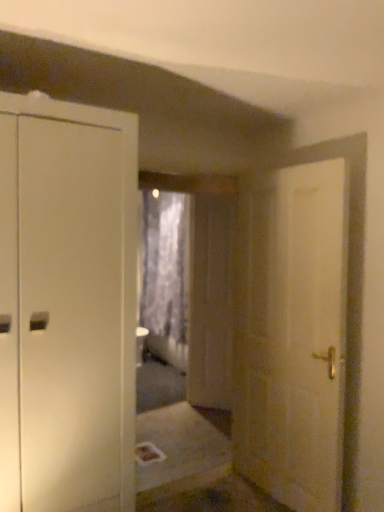
What do you see at coordinates (291, 334) in the screenshot?
I see `white matte door at right` at bounding box center [291, 334].

Measure the distance between transparent plastic screen door at center and camera.

transparent plastic screen door at center is 12.70 feet from camera.

Locate an element on the screen. This screenshot has height=512, width=384. white matte door at right is located at coordinates (291, 334).

Based on their sizes in the image, would you say transparent plastic screen door at center is bigger or smaller than gray textured curtain at center?

Clearly, transparent plastic screen door at center is smaller in size than gray textured curtain at center.

Which object is further away from the camera, transparent plastic screen door at center or gray textured curtain at center?

gray textured curtain at center.

Considering the positions of objects transparent plastic screen door at center and gray textured curtain at center in the image provided, who is more to the right, transparent plastic screen door at center or gray textured curtain at center?

From the viewer's perspective, transparent plastic screen door at center appears more on the right side.

Is transparent plastic screen door at center oriented away from gray textured curtain at center?

No, transparent plastic screen door at center is not facing the opposite direction of gray textured curtain at center.

The height and width of the screenshot is (512, 384). In the image, there is a white matte door at right. Find the location of `screen door above it (from the image's perspective)`. screen door above it (from the image's perspective) is located at coordinates point(210,302).

Would you say transparent plastic screen door at center is inside or outside white matte door at right?

The correct answer is: outside.

Who is bigger, transparent plastic screen door at center or white matte door at right?

Bigger between the two is white matte door at right.

Is gray textured curtain at center beside transparent plastic screen door at center?

No, gray textured curtain at center is not with transparent plastic screen door at center.

Does gray textured curtain at center have a greater height compared to transparent plastic screen door at center?

Incorrect, the height of gray textured curtain at center is not larger of that of transparent plastic screen door at center.

From a real-world perspective, relative to transparent plastic screen door at center, is gray textured curtain at center vertically above or below?

gray textured curtain at center is above transparent plastic screen door at center.

Do you think gray textured curtain at center is within transparent plastic screen door at center, or outside of it?

The correct answer is: outside.

Which is farther from the camera, (241,358) or (163,324)?

The point (163,324) is behind.

Which object is closer to the camera taking this photo, white matte door at right or gray textured curtain at center?

white matte door at right is closer to the camera.

Is white matte door at right placed right next to gray textured curtain at center?

No, white matte door at right is not beside gray textured curtain at center.

From a real-world perspective, which is physically above, white matte door at right or gray textured curtain at center?

gray textured curtain at center is physically above.

Is gray textured curtain at center positioned before white matte door at right?

No, gray textured curtain at center is behind white matte door at right.

From the image's perspective, would you say gray textured curtain at center is positioned over white matte door at right?

Yes, from the image's perspective, gray textured curtain at center is on top of white matte door at right.

From a real-world perspective, is gray textured curtain at center on top of white matte door at right?

Yes.

Locate an element on the screen. The width and height of the screenshot is (384, 512). door located underneath the gray textured curtain at center (from a real-world perspective) is located at coordinates (291, 334).

Considering the relative sizes of white matte door at right and transparent plastic screen door at center in the image provided, is white matte door at right wider than transparent plastic screen door at center?

Yes, white matte door at right is wider than transparent plastic screen door at center.

Considering the points (246, 186) and (190, 218), which point is in front, point (246, 186) or point (190, 218)?

Positioned in front is point (246, 186).

Could you tell me if white matte door at right is turned towards transparent plastic screen door at center?

No, white matte door at right does not turn towards transparent plastic screen door at center.

Considering the sizes of objects white matte door at right and transparent plastic screen door at center in the image provided, who is smaller, white matte door at right or transparent plastic screen door at center?

With smaller size is transparent plastic screen door at center.

The image size is (384, 512). I want to click on curtain that is behind the transparent plastic screen door at center, so click(165, 264).

Identify the location of door located on the right of transparent plastic screen door at center. The width and height of the screenshot is (384, 512). (291, 334).

Estimate the real-world distances between objects in this image. Which object is further from white matte door at right, transparent plastic screen door at center or gray textured curtain at center?

gray textured curtain at center.

Considering their positions, is gray textured curtain at center positioned closer to white matte door at right than transparent plastic screen door at center?

Among the two, transparent plastic screen door at center is located nearer to white matte door at right.

Looking at the image, which one is located closer to gray textured curtain at center, white matte door at right or transparent plastic screen door at center?

transparent plastic screen door at center lies closer to gray textured curtain at center than the other object.

Estimate the real-world distances between objects in this image. Which object is further from transparent plastic screen door at center, white matte door at right or gray textured curtain at center?

gray textured curtain at center lies further to transparent plastic screen door at center than the other object.

When comparing their distances from gray textured curtain at center, does transparent plastic screen door at center or white matte door at right seem further?

The object further to gray textured curtain at center is white matte door at right.

Which object lies further to the anchor point transparent plastic screen door at center, gray textured curtain at center or white matte door at right?

gray textured curtain at center is positioned further to the anchor transparent plastic screen door at center.

Identify the location of screen door between white matte door at right and gray textured curtain at center in the front-back direction. [x=210, y=302].